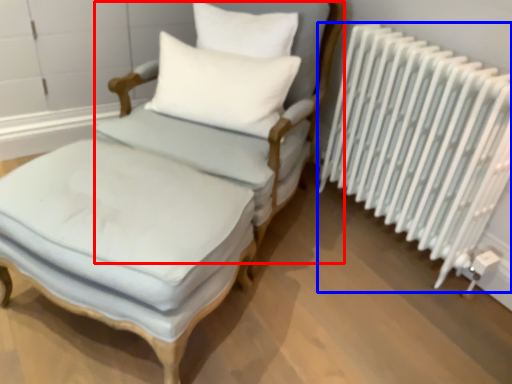
Question: Among these objects, which one is farthest to the camera, armchair (highlighted by a red box) or radiator (highlighted by a blue box)?

Choices:
 (A) armchair
 (B) radiator

Answer: (B)